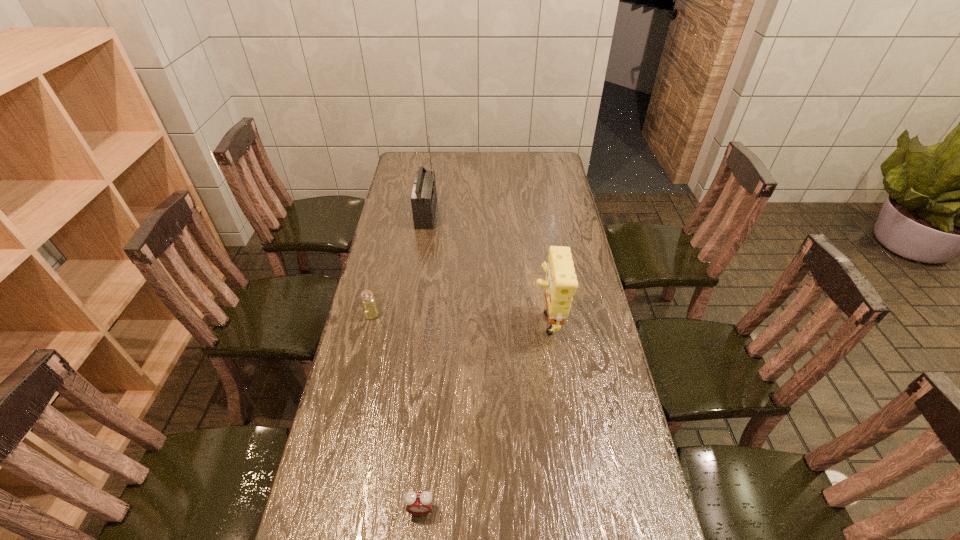
In order to click on object that stands as the closest to the farthest object in this screenshot , I will do click(370, 309).